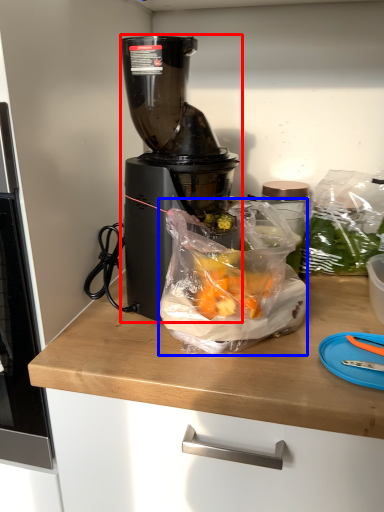
Question: Among these objects, which one is nearest to the camera, blender (highlighted by a red box) or waste (highlighted by a blue box)?

Choices:
 (A) blender
 (B) waste

Answer: (B)